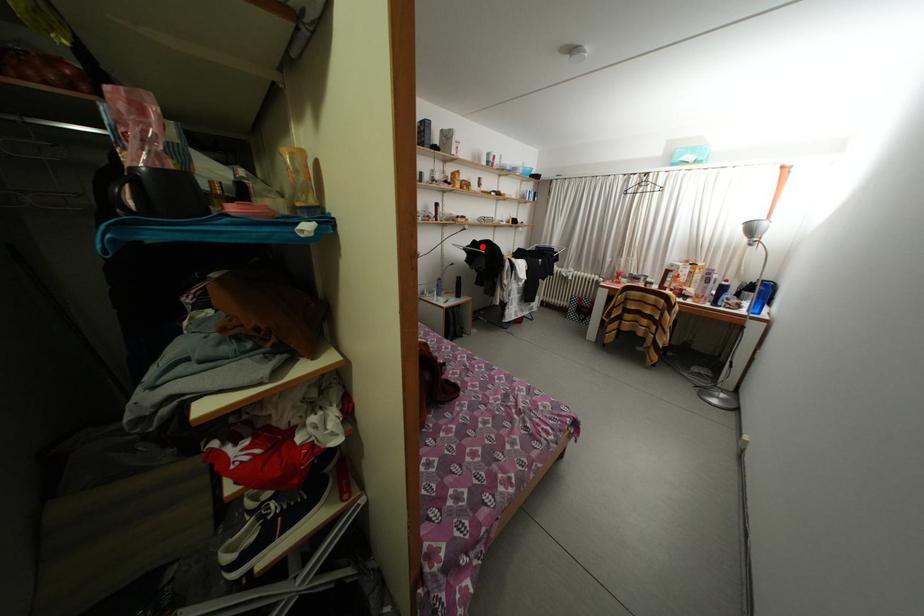
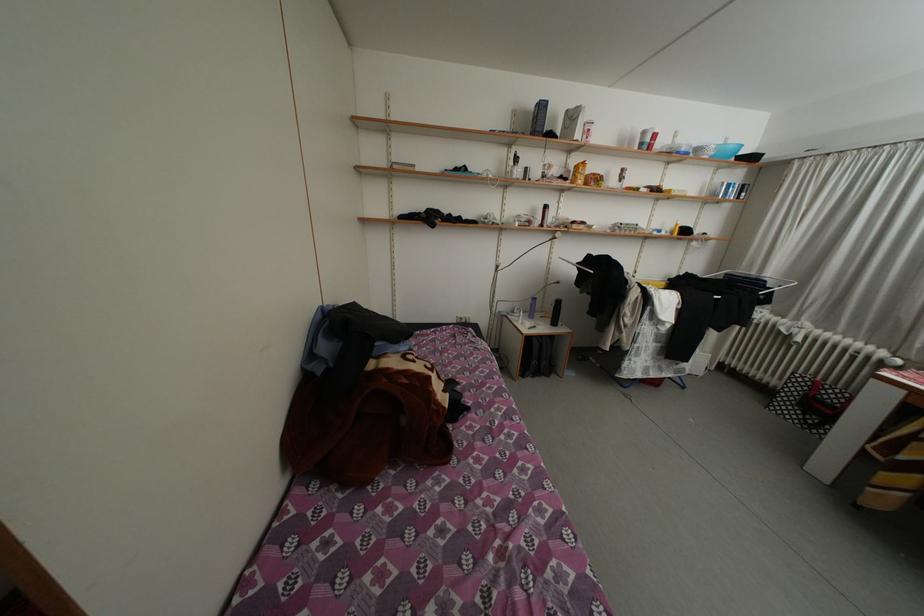
Where in the second image is the point corresponding to the highlighted location from the first image?

(597, 262)